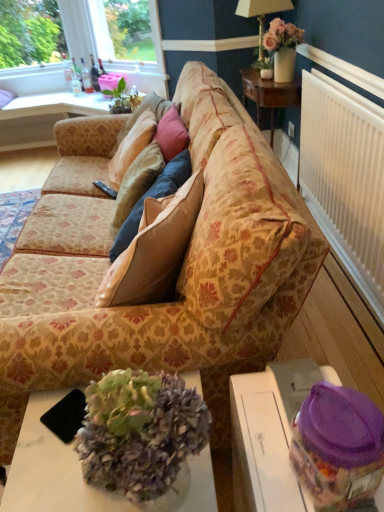
Question: Is point (91, 269) closer or farther from the camera than point (259, 42)?

Choices:
 (A) farther
 (B) closer

Answer: (B)

Question: In the image, is floral-patterned fabric couch at center on the left side or the right side of matte gold lamp at upper center?

Choices:
 (A) left
 (B) right

Answer: (A)

Question: Estimate the real-world distances between objects in this image. Which object is closer to the matte gold lamp at upper center?

Choices:
 (A) matte wood table at upper left, arranged as the second table when viewed from the right
 (B) pink matte vase at upper right
 (C) white marble desk at center
 (D) translucent plastic container at lower right, the 1th table positioned from the bottom
 (E) white plastic radiator at right

Answer: (B)

Question: Which object is positioned farthest from the floral-patterned fabric couch at center?

Choices:
 (A) translucent plastic container at lower right, placed as the 2th table when sorted from back to front
 (B) white plastic radiator at right
 (C) white marble desk at center
 (D) matte gold lamp at upper center
 (E) matte wood table at upper left, which is counted as the second table, starting from the front

Answer: (D)